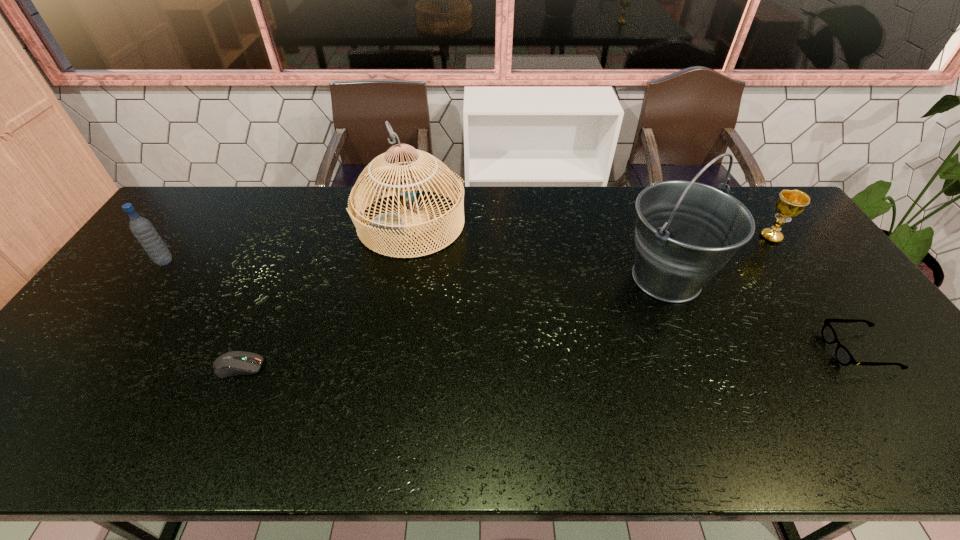
Locate an element on the screen. free space at the far edge of the desktop is located at coordinates (592, 226).

In the image, there is a desktop. In order to click on vacant space at the left edge in this screenshot , I will do `click(143, 306)`.

The height and width of the screenshot is (540, 960). What are the coordinates of `vacant space at the right edge of the desktop` in the screenshot? It's located at (793, 278).

What are the coordinates of `free space at the far right corner of the desktop` in the screenshot? It's located at (749, 191).

The width and height of the screenshot is (960, 540). In order to click on vacant space that is in between the spectacles and the shortest object in this screenshot , I will do tap(548, 359).

Where is `free spot between the third object from left to right and the chalice`? free spot between the third object from left to right and the chalice is located at coordinates (591, 230).

Identify the location of free space between the chalice and the birdcage. This screenshot has width=960, height=540. (591, 230).

Where is `free space between the fourth tallest object and the fourth object from right to left`? The height and width of the screenshot is (540, 960). free space between the fourth tallest object and the fourth object from right to left is located at coordinates (591, 230).

This screenshot has height=540, width=960. In order to click on free space that is in between the shortest object and the bucket in this screenshot , I will do `click(452, 322)`.

This screenshot has height=540, width=960. In order to click on free space between the bucket and the water bottle in this screenshot , I will do `click(416, 270)`.